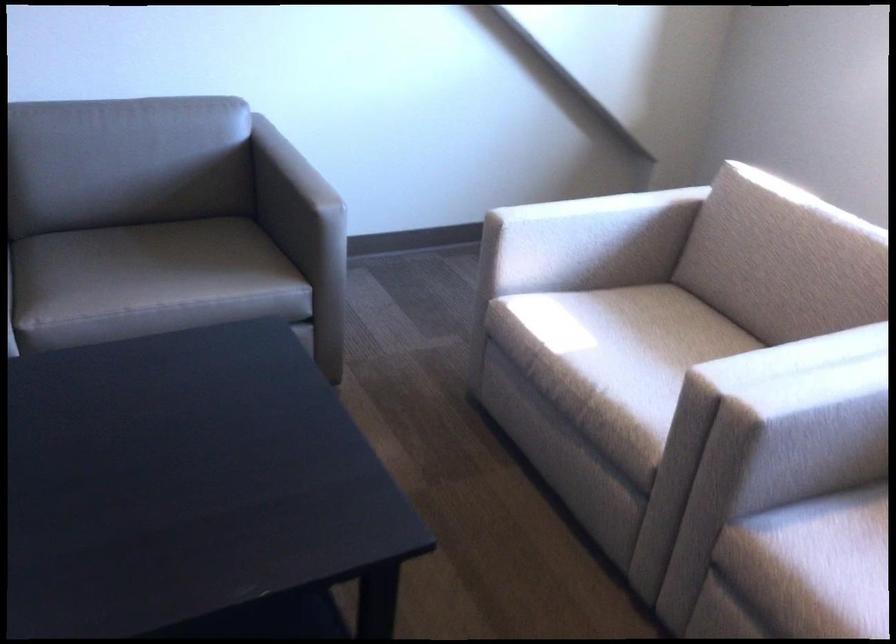
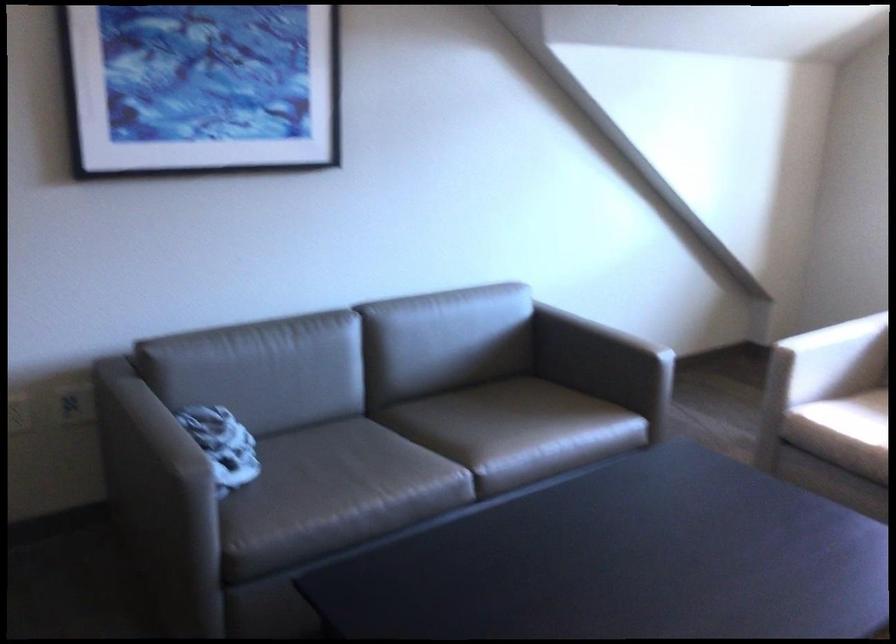
The point at [109,279] is marked in the first image. Where is the corresponding point in the second image?

(497, 430)